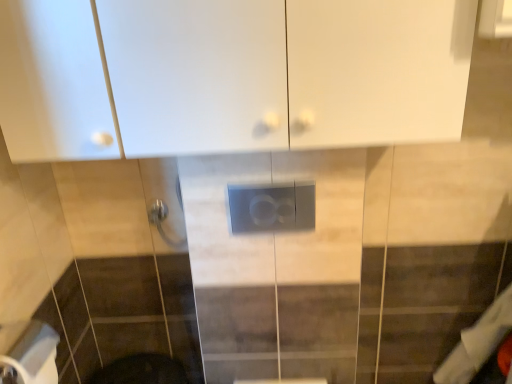
Question: Is satin gray panel at center to the left or to the right of white glossy cabinet at upper center in the image?

Choices:
 (A) left
 (B) right

Answer: (B)

Question: Is point (291, 221) positioned closer to the camera than point (227, 64)?

Choices:
 (A) closer
 (B) farther

Answer: (B)

Question: Estimate the real-world distances between objects in this image. Which object is farther from the satin gray panel at center?

Choices:
 (A) white matte toilet paper at lower left
 (B) white glossy cabinet at upper center

Answer: (A)

Question: Which object is the closest to the satin gray panel at center?

Choices:
 (A) white glossy cabinet at upper center
 (B) white matte toilet paper at lower left

Answer: (A)